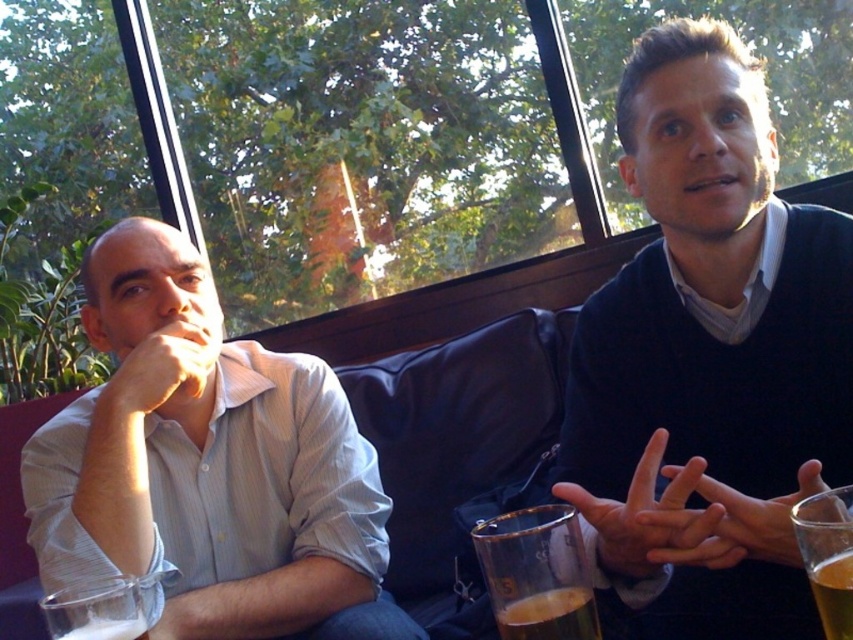
Is clear glass beer at lower left thinner than translucent glass beer at lower center?

No, clear glass beer at lower left is not thinner than translucent glass beer at lower center.

Between clear glass beer at lower left and translucent glass beer at lower center, which one appears on the right side from the viewer's perspective?

translucent glass beer at lower center is more to the right.

Describe the element at coordinates (96, 611) in the screenshot. I see `clear glass beer at lower left` at that location.

Identify the location of clear glass beer at lower left. The height and width of the screenshot is (640, 853). (96, 611).

Can you confirm if clear glass beer at lower left is smaller than translucent glass beer at lower left?

Actually, clear glass beer at lower left might be larger than translucent glass beer at lower left.

At what (x,y) coordinates should I click in order to perform the action: click on clear glass beer at lower left. Please return your answer as a coordinate pair (x, y). The height and width of the screenshot is (640, 853). Looking at the image, I should click on (96, 611).

Is translucent glass at right to the left of clear glass beer at lower left from the viewer's perspective?

No, translucent glass at right is not to the left of clear glass beer at lower left.

Does translucent glass at right have a lesser width compared to clear glass beer at lower left?

Yes, translucent glass at right is thinner than clear glass beer at lower left.

Between point (828, 611) and point (99, 636), which one is positioned in front?

Positioned in front is point (828, 611).

Locate an element on the screen. translucent glass at right is located at coordinates (827, 556).